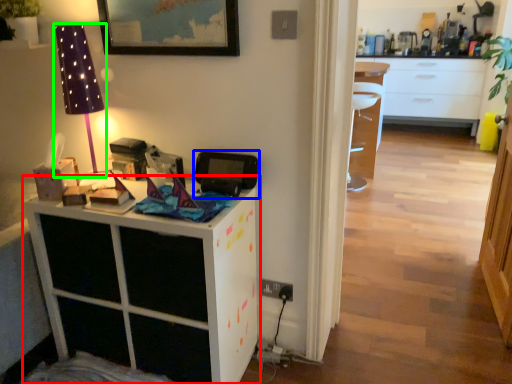
Question: Considering the real-world distances, which object is farthest from cabinetry (highlighted by a red box)? appliance (highlighted by a blue box) or table lamp (highlighted by a green box)?

Choices:
 (A) appliance
 (B) table lamp

Answer: (B)